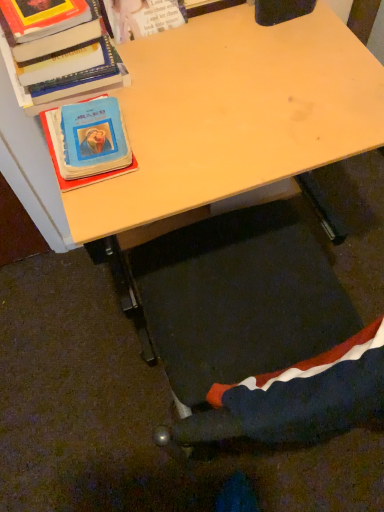
Identify the location of free space in front of blue matte book at left, arranged as the 2th book when viewed from the top. (112, 206).